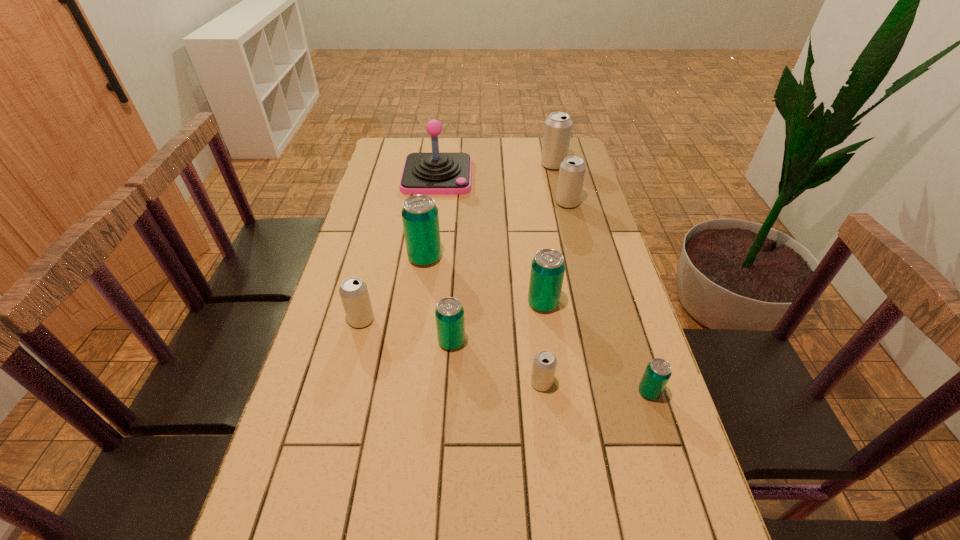
Choose which teal beer can is the nearest neighbor to the smallest teal beer can. Please provide its 2D coordinates. Your answer should be formatted as a tuple, i.e. [(x, y)], where the tuple contains the x and y coordinates of a point satisfying the conditions above.

[(548, 267)]

Find the location of a particular element. The image size is (960, 540). free space that satisfies the following two spatial constraints: 1. forward from the base of the pink joystick; 2. on the right side of the third smallest teal beer can is located at coordinates 420,303.

I want to click on vacant space that satisfies the following two spatial constraints: 1. on the back side of the second teal beer can from right to left; 2. on the left side of the farthest beer can, so click(524, 165).

Where is `vacant region that satisfies the following two spatial constraints: 1. on the front side of the second teal beer can from left to right; 2. on the right side of the third biggest white beer can`? This screenshot has width=960, height=540. vacant region that satisfies the following two spatial constraints: 1. on the front side of the second teal beer can from left to right; 2. on the right side of the third biggest white beer can is located at coordinates coord(356,341).

At what (x,y) coordinates should I click in order to perform the action: click on blank area in the image that satisfies the following two spatial constraints: 1. on the front side of the second farthest white beer can; 2. on the left side of the rightmost beer can. Please return your answer as a coordinate pair (x, y). Looking at the image, I should click on (614, 392).